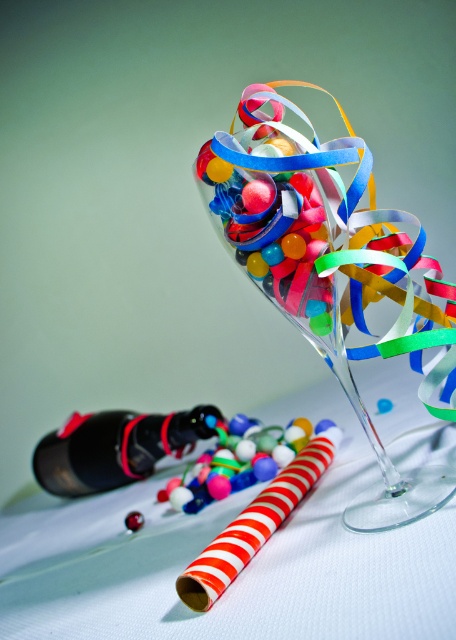
Question: Is translucent glass martini glass at center above black matte bottle at lower left?

Choices:
 (A) yes
 (B) no

Answer: (A)

Question: In this image, where is black matte bottle at lower left located relative to shiny multicolored beads at center?

Choices:
 (A) right
 (B) left

Answer: (B)

Question: Can you confirm if translucent glass martini glass at center is positioned above black matte bottle at lower left?

Choices:
 (A) no
 (B) yes

Answer: (B)

Question: Which object appears closest to the camera in this image?

Choices:
 (A) black matte bottle at lower left
 (B) translucent glass martini glass at center
 (C) shiny multicolored beads at center

Answer: (B)

Question: Which of the following is the farthest from the observer?

Choices:
 (A) (281, 168)
 (B) (114, 419)
 (C) (218, 477)

Answer: (B)

Question: Which point is closer to the camera?

Choices:
 (A) (330, 419)
 (B) (252, 116)
 (C) (108, 467)

Answer: (B)